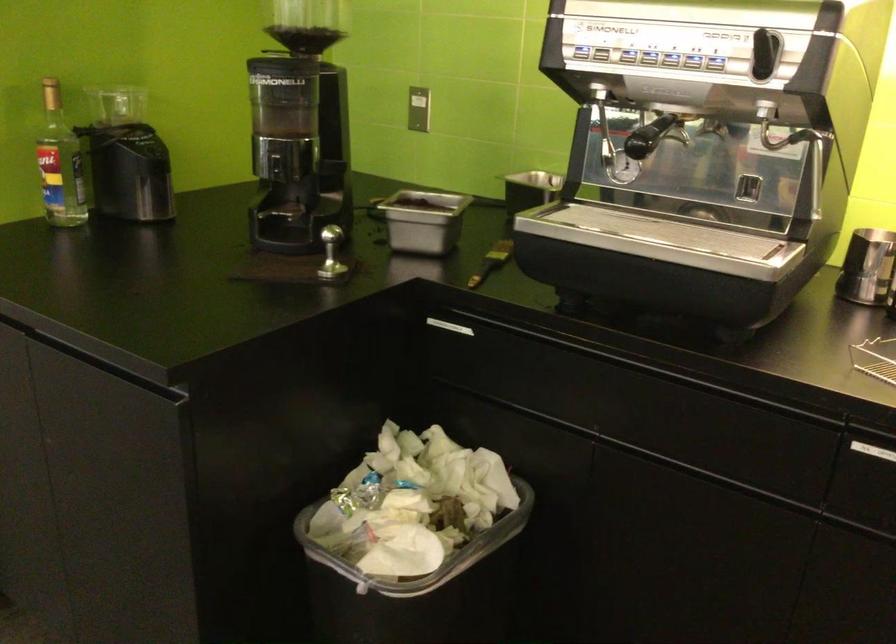
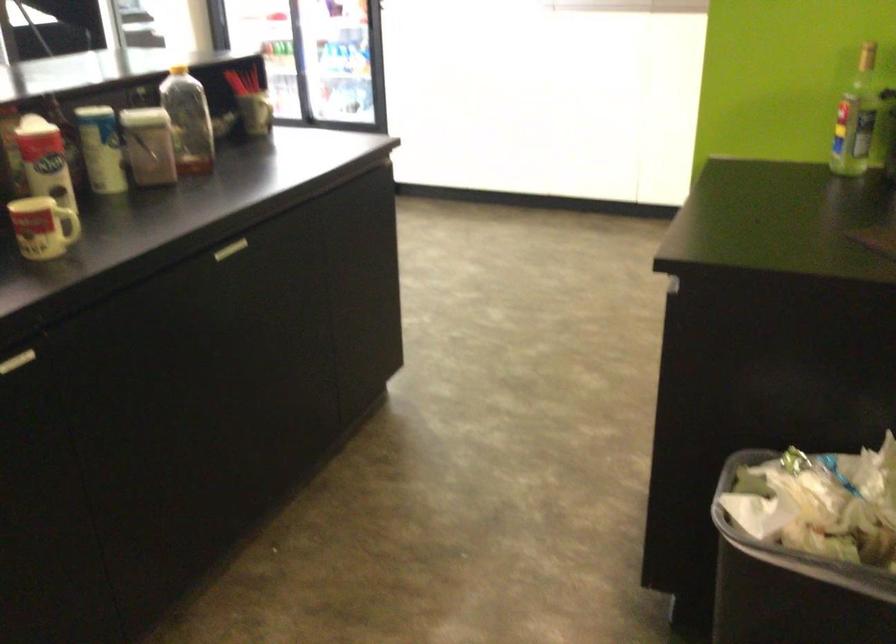
In the second image, find the point that corresponds to point 104,174 in the first image.

(856, 118)